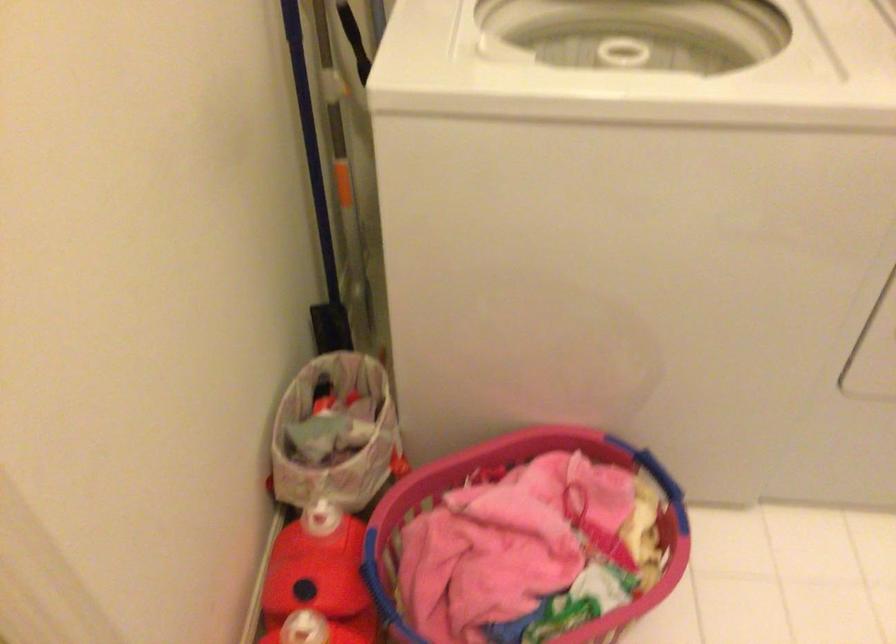
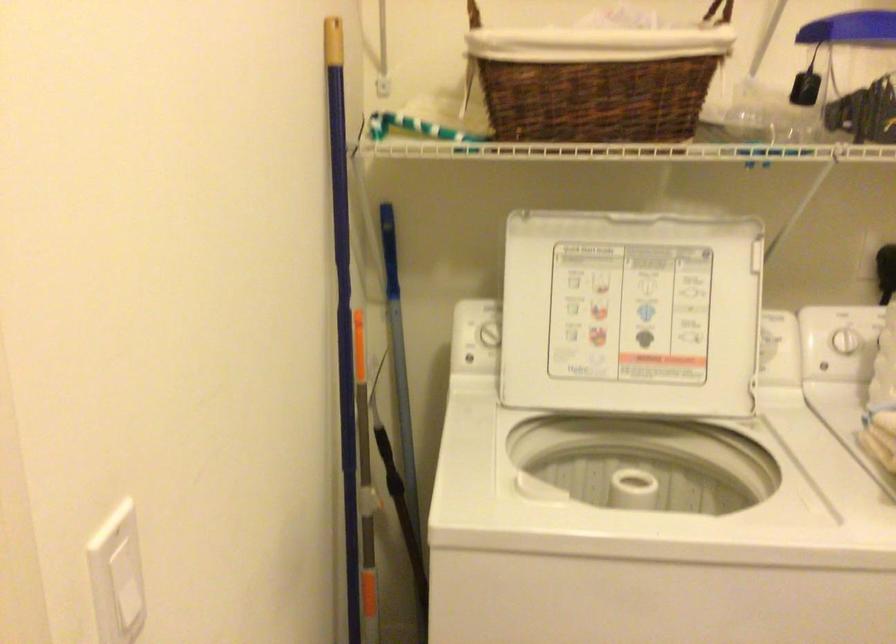
Question: How did the camera likely rotate?

Choices:
 (A) Left
 (B) Right
 (C) Up
 (D) Down

Answer: (C)